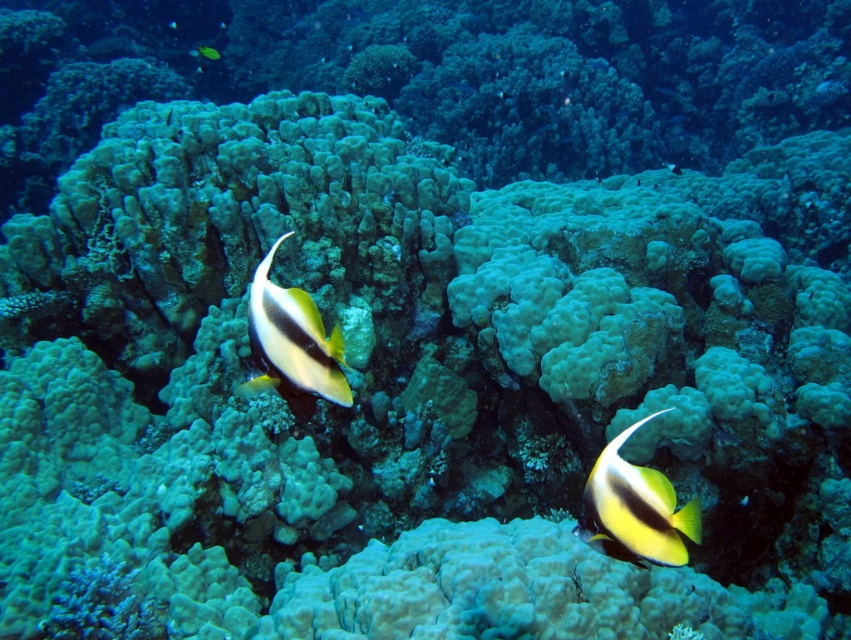
You are a marine biologist studying underwater life. You notice a point marked at coordinates (x=635, y=509) in the image. Based on the scene description, can you identify which object this point is located on?

The point at coordinates (x=635, y=509) is located on the yellow matte fish at lower right.

You are an underwater photographer aiming to capture the yellow matte fish at lower right and the yellow matte fish at center. Which fish should you choose if you want to photograph a fish with a larger body size?

The yellow matte fish at center has a larger body size than the yellow matte fish at lower right, so you should choose the yellow matte fish at center.